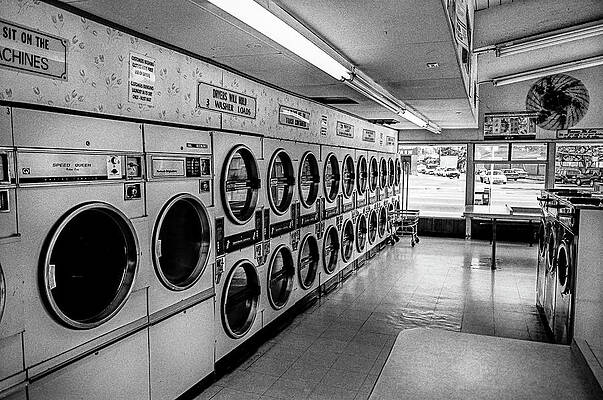
Where is `fan`? The height and width of the screenshot is (400, 603). fan is located at coordinates (555, 107).